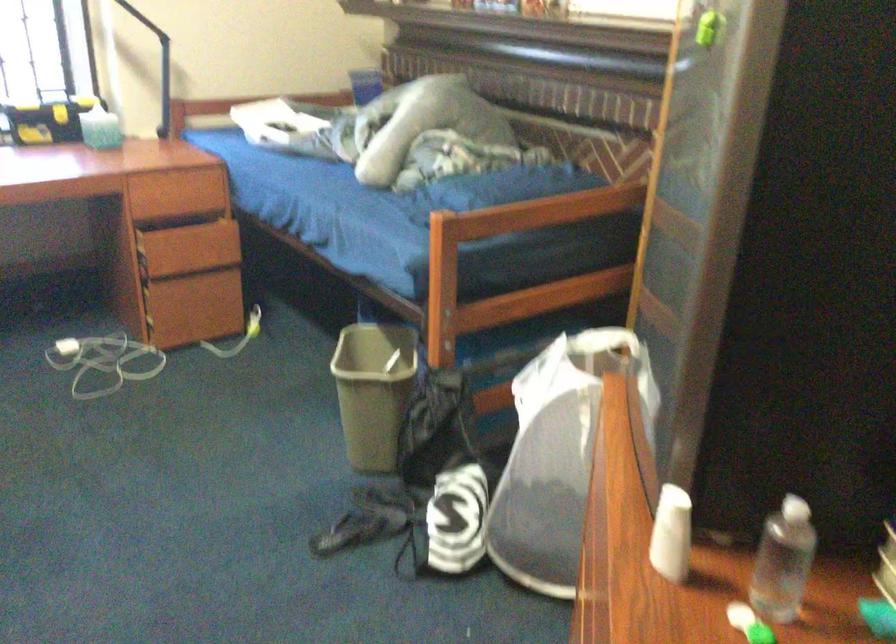
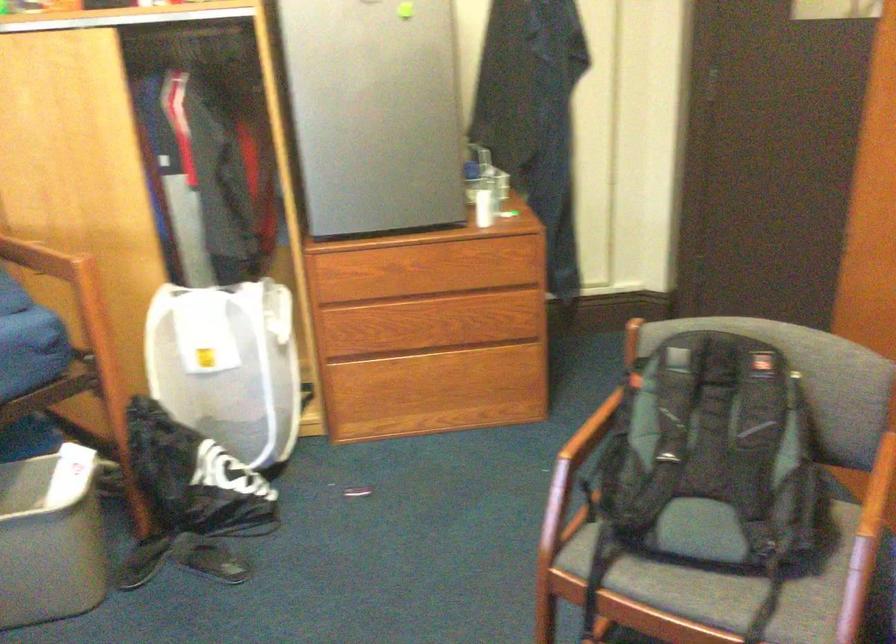
Locate, in the second image, the point that corresponds to [389,525] in the first image.

(211, 559)